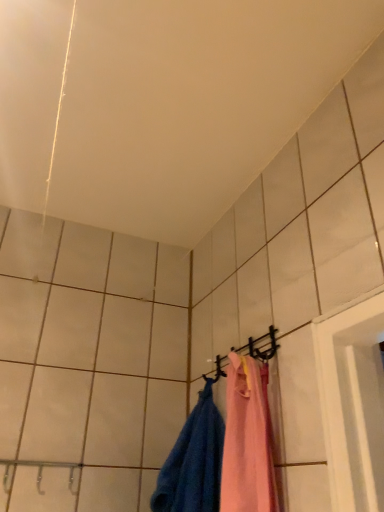
In order to face blue cotton towel at lower right, should I rotate leftwards or rightwards?

Rotate left and turn 2.222 degrees.

This screenshot has width=384, height=512. What do you see at coordinates (223, 450) in the screenshot? I see `blue cotton towel at lower right` at bounding box center [223, 450].

You are a GUI agent. You are given a task and a screenshot of the screen. Output one action in this format:
    pyautogui.click(x=<x>, y=<y>)
    Task: Click on the blue cotton towel at lower right
    
    Given the screenshot: What is the action you would take?
    pyautogui.click(x=223, y=450)

What is the approximate height of blue cotton towel at lower right?

blue cotton towel at lower right is 13.49 inches tall.

This screenshot has height=512, width=384. What do you see at coordinates (261, 346) in the screenshot? I see `black matte hanger at upper center` at bounding box center [261, 346].

Where is `black matte hanger at upper center`? black matte hanger at upper center is located at coordinates (261, 346).

In order to face black matte hanger at upper center, should I rotate leftwards or rightwards?

Rotate right and turn 6.044 degrees.

This screenshot has width=384, height=512. In order to click on blue cotton towel at lower right in this screenshot , I will do `click(223, 450)`.

Considering the relative positions of black matte hanger at upper center and blue cotton towel at lower right in the image provided, is black matte hanger at upper center to the right of blue cotton towel at lower right from the viewer's perspective?

Correct, you'll find black matte hanger at upper center to the right of blue cotton towel at lower right.

Is black matte hanger at upper center closer to camera compared to blue cotton towel at lower right?

That is False.

Which is nearer, (x=224, y=359) or (x=186, y=471)?

Point (x=224, y=359) is farther from the camera than point (x=186, y=471).

From the image's perspective, is black matte hanger at upper center beneath blue cotton towel at lower right?

No, from the image's perspective, black matte hanger at upper center is not beneath blue cotton towel at lower right.

From a real-world perspective, who is located higher, black matte hanger at upper center or blue cotton towel at lower right?

black matte hanger at upper center, from a real-world perspective.

Between black matte hanger at upper center and blue cotton towel at lower right, which one has smaller width?

Thinner between the two is black matte hanger at upper center.

Between black matte hanger at upper center and blue cotton towel at lower right, which one has less height?

black matte hanger at upper center.

Consider the image. Does black matte hanger at upper center have a smaller size compared to blue cotton towel at lower right?

Correct, black matte hanger at upper center occupies less space than blue cotton towel at lower right.

Is blue cotton towel at lower right surrounded by black matte hanger at upper center?

No.

Are black matte hanger at upper center and blue cotton towel at lower right located far from each other?

Actually, black matte hanger at upper center and blue cotton towel at lower right are a little close together.

Is black matte hanger at upper center facing towards blue cotton towel at lower right?

Yes.

Based on the photo, how many degrees apart are the facing directions of black matte hanger at upper center and blue cotton towel at lower right?

They differ by 0.00113 degrees in their facing directions.

You are a GUI agent. You are given a task and a screenshot of the screen. Output one action in this format:
    pyautogui.click(x=<x>, y=<y>)
    Task: Click on the laundry that is in front of the black matte hanger at upper center
    The image size is (384, 512).
    Given the screenshot: What is the action you would take?
    pyautogui.click(x=223, y=450)

Between blue cotton towel at lower right and black matte hanger at upper center, which one appears on the left side from the viewer's perspective?

blue cotton towel at lower right.

Is blue cotton towel at lower right positioned behind black matte hanger at upper center?

No, blue cotton towel at lower right is closer to the viewer.

Between point (235, 464) and point (263, 360), which one is positioned behind?

Positioned behind is point (263, 360).

From the image's perspective, is blue cotton towel at lower right positioned above or below black matte hanger at upper center?

blue cotton towel at lower right is situated lower than black matte hanger at upper center in the image.

Consider the image. From a real-world perspective, is blue cotton towel at lower right above or below black matte hanger at upper center?

Clearly, from a real-world perspective, blue cotton towel at lower right is below black matte hanger at upper center.

Looking at their sizes, would you say blue cotton towel at lower right is wider or thinner than black matte hanger at upper center?

blue cotton towel at lower right is wider than black matte hanger at upper center.

Considering the relative sizes of blue cotton towel at lower right and black matte hanger at upper center in the image provided, is blue cotton towel at lower right taller than black matte hanger at upper center?

Correct, blue cotton towel at lower right is much taller as black matte hanger at upper center.

Who is smaller, blue cotton towel at lower right or black matte hanger at upper center?

black matte hanger at upper center is smaller.

Based on the photo, would you say blue cotton towel at lower right contains black matte hanger at upper center?

No, black matte hanger at upper center is not inside blue cotton towel at lower right.

Are blue cotton towel at lower right and black matte hanger at upper center far apart?

Actually, blue cotton towel at lower right and black matte hanger at upper center are a little close together.

Could you tell me if blue cotton towel at lower right is turned towards black matte hanger at upper center?

No, blue cotton towel at lower right does not turn towards black matte hanger at upper center.

In the image, there is a black matte hanger at upper center. Find the location of `laundry below it (from the image's perspective)`. laundry below it (from the image's perspective) is located at coordinates (223, 450).

Where is `hanger on the right of blue cotton towel at lower right`? hanger on the right of blue cotton towel at lower right is located at coordinates (261, 346).

The height and width of the screenshot is (512, 384). Identify the location of laundry below the black matte hanger at upper center (from the image's perspective). (223, 450).